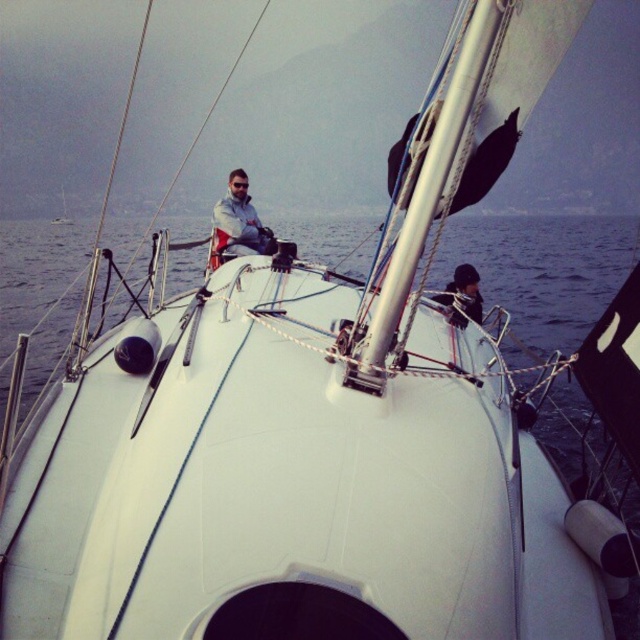
Question: Which object is positioned farthest from the white matte sailboat at center?

Choices:
 (A) black matte jacket at center
 (B) white matte water at center
 (C) white matte jacket at center

Answer: (A)

Question: Which point is farther to the camera?

Choices:
 (A) white matte water at center
 (B) white matte sailboat at center
 (C) black matte jacket at center
 (D) white matte jacket at center

Answer: (B)

Question: Which object appears closest to the camera in this image?

Choices:
 (A) white matte jacket at center
 (B) white matte water at center
 (C) black matte jacket at center
 (D) white matte sailboat at center

Answer: (C)

Question: Does white matte water at center appear on the left side of black matte jacket at center?

Choices:
 (A) no
 (B) yes

Answer: (B)

Question: Is the position of white matte jacket at center less distant than that of black matte jacket at center?

Choices:
 (A) no
 (B) yes

Answer: (A)

Question: Can you confirm if black matte jacket at center is wider than white matte sailboat at center?

Choices:
 (A) no
 (B) yes

Answer: (A)